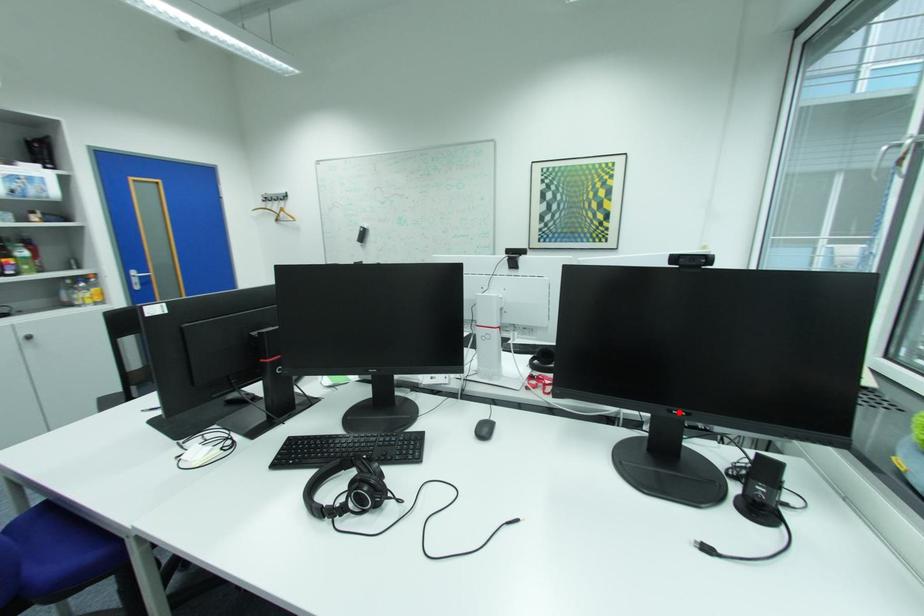
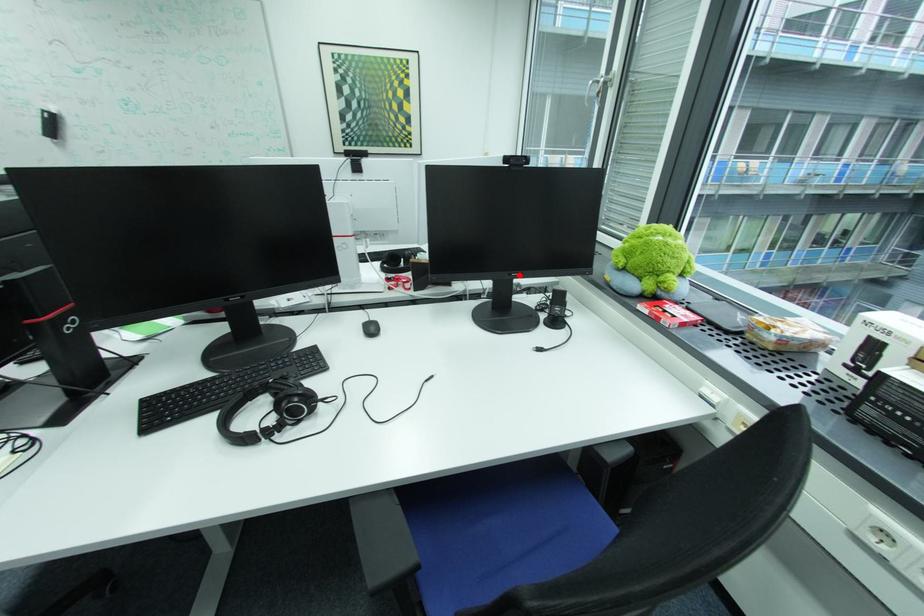
I am providing you with two images of the same scene from different viewpoints. A red point is marked on the first image and another point is marked on the second image. Are the points marked in image1 and image2 representing the same 3D position?

Yes